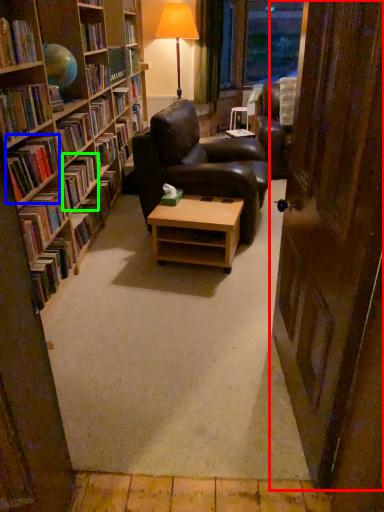
Question: Which is nearer to the door (highlighted by a red box)? book (highlighted by a blue box) or book (highlighted by a green box).

Choices:
 (A) book
 (B) book

Answer: (A)